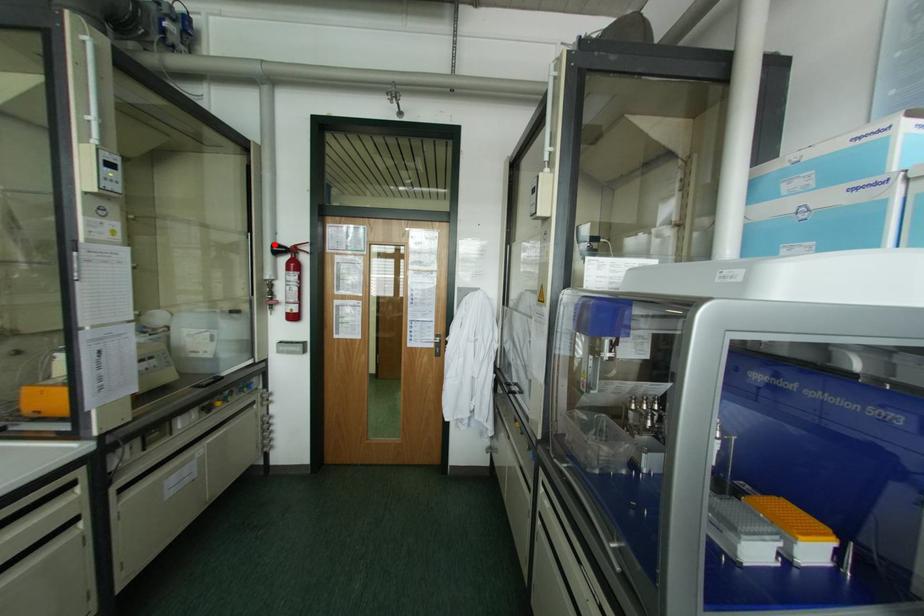
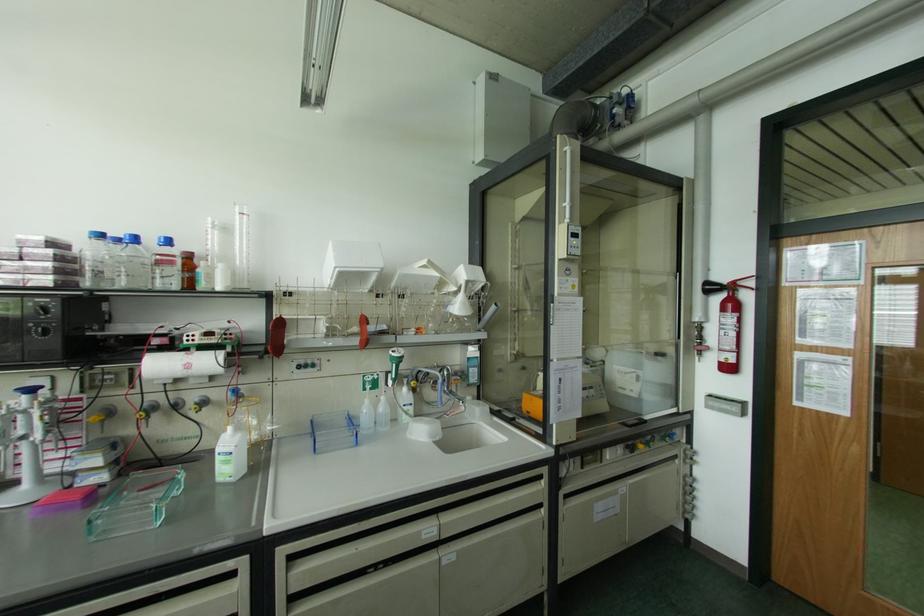
Question: I am providing you with two images of the same scene from different viewpoints. A red point is marked on the first image. Is the red point's position out of view in image 2?

Choices:
 (A) Yes
 (B) No

Answer: (B)